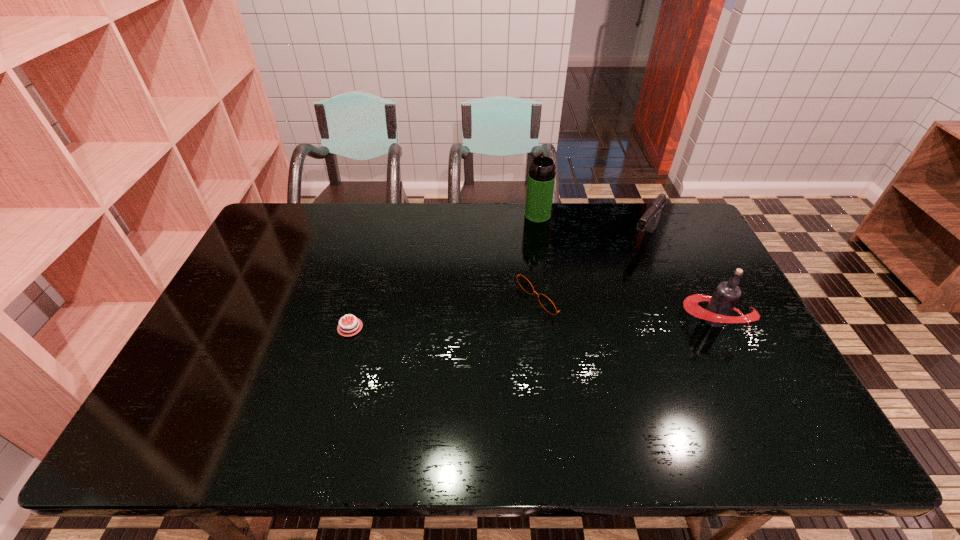
Choose which object is the third nearest neighbor to the sunglasses. Please provide its 2D coordinates. Your answer should be formatted as a tuple, i.e. [(x, y)], where the tuple contains the x and y coordinates of a point satisfying the conditions above.

[(726, 295)]

Locate an element on the screen. The width and height of the screenshot is (960, 540). object that ranks as the closest to the pistol is located at coordinates (547, 304).

Image resolution: width=960 pixels, height=540 pixels. Find the location of `blank area in the image that satisfies the following two spatial constraints: 1. on the front side of the root beer; 2. on the label of the pistol`. blank area in the image that satisfies the following two spatial constraints: 1. on the front side of the root beer; 2. on the label of the pistol is located at coordinates (679, 320).

Locate an element on the screen. The height and width of the screenshot is (540, 960). blank space that satisfies the following two spatial constraints: 1. on the back side of the fourth nearest object; 2. on the right side of the shortest object is located at coordinates tap(374, 238).

I want to click on free space that satisfies the following two spatial constraints: 1. on the back side of the leftmost object; 2. on the label of the fourth shortest object, so click(x=352, y=320).